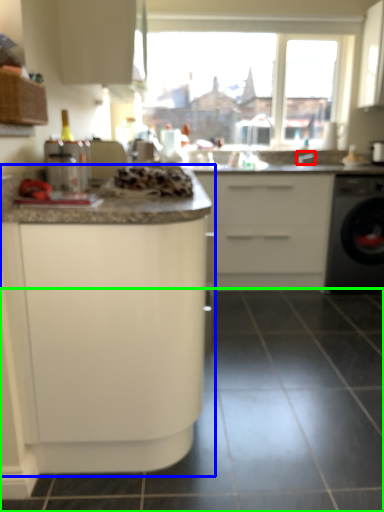
Question: Which is farther away from faucet (highlighted by a red box)? cabinetry (highlighted by a blue box) or tile (highlighted by a green box)?

Choices:
 (A) cabinetry
 (B) tile

Answer: (A)